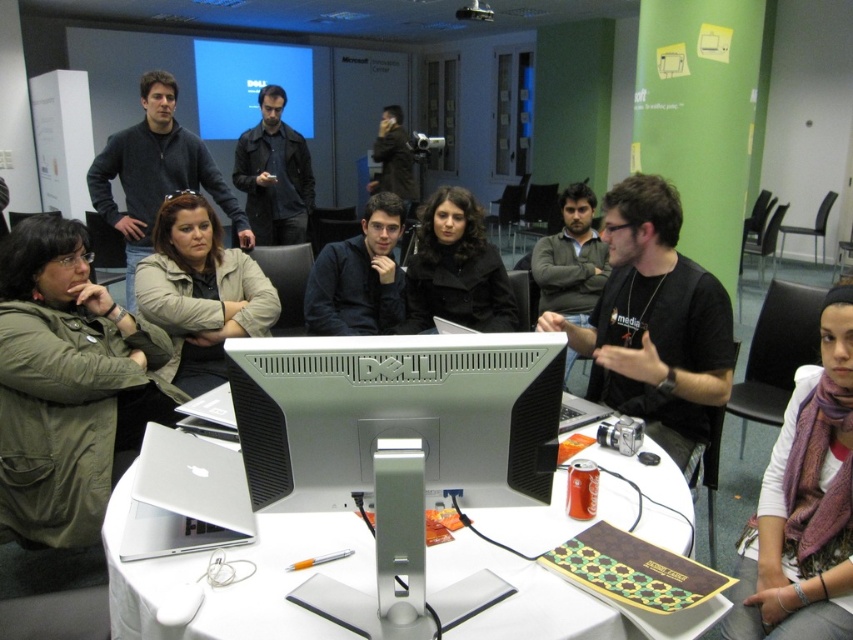
You are standing in the conference room and want to place a 1.2 meter long object on the table. The point at coordinates point (529, 400) is 1.15 meters from the camera. Can you fit the object on the table starting from that point without it extending beyond the table?

The point at coordinates point (529, 400) is 1.15 meters from the camera. Since the object is 1.2 meters long, placing it starting from that point would cause it to extend 0.05 meters beyond the table edge, so it won t fit completely.

You are standing in front of the table and want to place a small object on the table. If you aim to place it closer to the camera, which of the two points should you target? The points are point (387, 358) and point (335, 296).

You should target point (387, 358) because it is closer to the camera than point (335, 296).